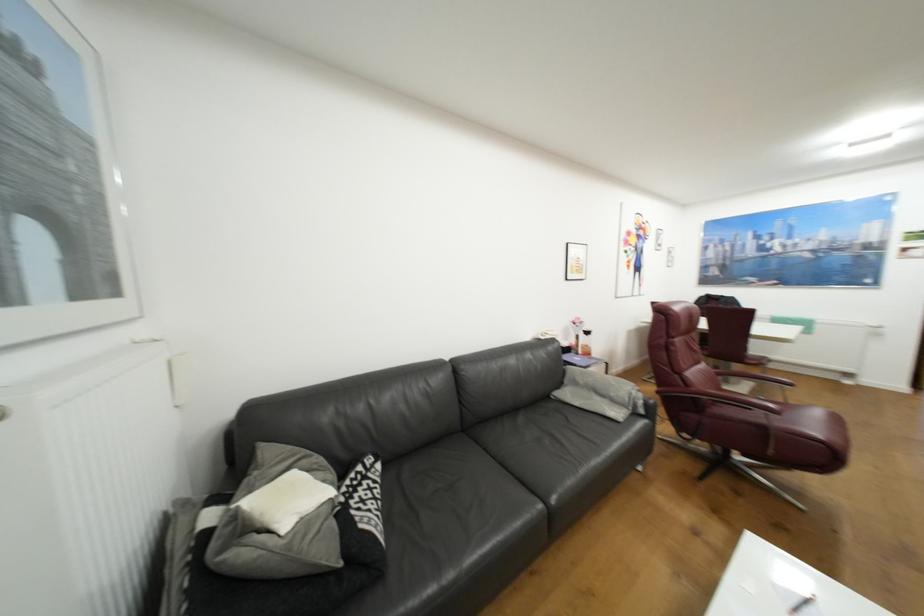
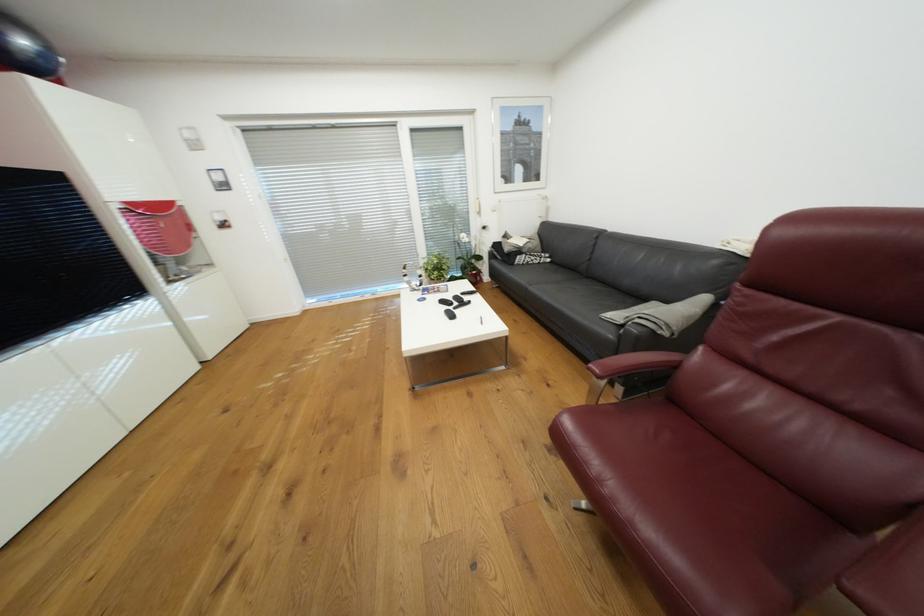
Locate, in the second image, the point that corresponds to point (554, 513) in the first image.

(533, 289)